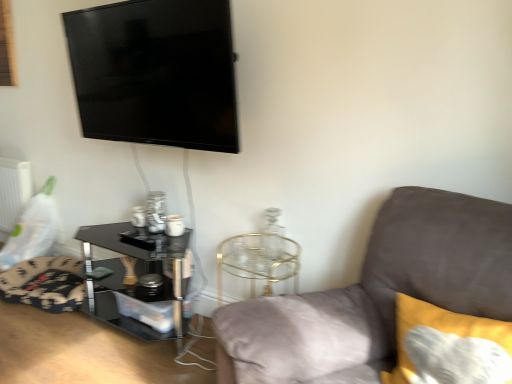
I want to click on vacant space positioned to the left of black glass table at lower left, so click(42, 337).